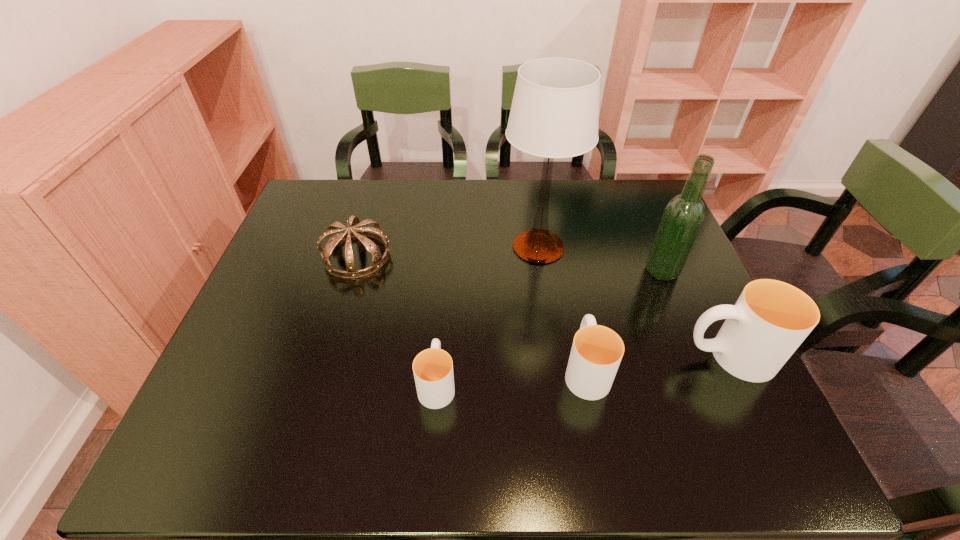
This screenshot has width=960, height=540. What are the coordinates of `vacant area that lies between the second tallest object and the tallest cup` in the screenshot? It's located at tap(695, 313).

This screenshot has width=960, height=540. What are the coordinates of `empty space that is in between the fourth shortest object and the tallest object` in the screenshot? It's located at (633, 301).

In order to click on vacant point located between the tiara and the second shortest cup in this screenshot , I will do `click(471, 313)`.

You are a GUI agent. You are given a task and a screenshot of the screen. Output one action in this format:
    pyautogui.click(x=<x>, y=<y>)
    Task: Click on the free area in between the liquor and the tallest object
    
    Given the screenshot: What is the action you would take?
    pyautogui.click(x=600, y=259)

I want to click on free space between the leftmost cup and the tiara, so click(x=396, y=320).

At what (x,y) coordinates should I click in order to perform the action: click on vacant space that is in between the leftmost cup and the tallest object. Please return your answer as a coordinate pair (x, y). Looking at the image, I should click on (488, 315).

Where is `free spot between the table lamp and the second tallest object`? The width and height of the screenshot is (960, 540). free spot between the table lamp and the second tallest object is located at coordinates (600, 259).

The height and width of the screenshot is (540, 960). In order to click on blank region between the leftmost object and the tallest cup in this screenshot , I will do `click(542, 306)`.

At what (x,y) coordinates should I click in order to perform the action: click on free spot between the second cup from right to left and the leftmost cup. Please return your answer as a coordinate pair (x, y). The width and height of the screenshot is (960, 540). Looking at the image, I should click on (512, 376).

At what (x,y) coordinates should I click in order to perform the action: click on unoccupied position between the fourth shortest object and the tallest object. Please return your answer as a coordinate pair (x, y). Image resolution: width=960 pixels, height=540 pixels. Looking at the image, I should click on tap(633, 301).